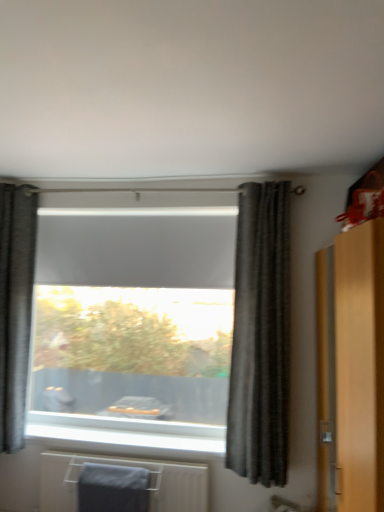
Based on the photo, measure the distance between gray fabric bath towel at lower left and camera.

gray fabric bath towel at lower left is 8.76 feet from camera.

Image resolution: width=384 pixels, height=512 pixels. What are the coordinates of `gray fabric bath towel at lower left` in the screenshot? It's located at (113, 488).

The height and width of the screenshot is (512, 384). Describe the element at coordinates (129, 466) in the screenshot. I see `gray matte towel at lower center` at that location.

The height and width of the screenshot is (512, 384). Describe the element at coordinates (260, 336) in the screenshot. I see `dark gray textured curtain at center, placed as the 2th curtain when sorted from left to right` at that location.

Where is `matte wooden dresser at right`? This screenshot has height=512, width=384. matte wooden dresser at right is located at coordinates (351, 368).

Locate an element on the screen. The image size is (384, 512). dark gray textured curtain at left, arranged as the second curtain when viewed from the right is located at coordinates pos(15,307).

Locate an element on the screen. The width and height of the screenshot is (384, 512). gray fabric bath towel at lower left is located at coordinates (113, 488).

Is gray matte blind at center a part of gray fabric bath towel at lower left?

That's incorrect, gray matte blind at center is not inside gray fabric bath towel at lower left.

Which object is further away from the camera, gray fabric bath towel at lower left or gray matte blind at center?

gray matte blind at center.

From their relative heights in the image, would you say gray fabric bath towel at lower left is taller or shorter than gray matte blind at center?

Clearly, gray fabric bath towel at lower left is shorter compared to gray matte blind at center.

Between gray fabric bath towel at lower left and gray matte blind at center, which one appears on the left side from the viewer's perspective?

gray fabric bath towel at lower left.

Is gray fabric bath towel at lower left facing away from dark gray textured curtain at left, arranged as the second curtain when viewed from the right?

No, gray fabric bath towel at lower left's orientation is not away from dark gray textured curtain at left, arranged as the second curtain when viewed from the right.

What are the coordinates of `bath towel below the dark gray textured curtain at left, the first curtain positioned from the left (from the image's perspective)` in the screenshot? It's located at (113, 488).

From the image's perspective, is gray fabric bath towel at lower left below dark gray textured curtain at left, the first curtain positioned from the left?

Yes.

Relative to dark gray textured curtain at left, the first curtain positioned from the left, is gray fabric bath towel at lower left in front or behind?

In the image, gray fabric bath towel at lower left appears in front of dark gray textured curtain at left, the first curtain positioned from the left.

Does gray matte towel at lower center have a lesser height compared to dark gray textured curtain at left, which is counted as the second curtain, starting from the front?

Correct, gray matte towel at lower center is not as tall as dark gray textured curtain at left, which is counted as the second curtain, starting from the front.

Considering the points (180, 501) and (0, 432), which point is in front, point (180, 501) or point (0, 432)?

Positioned in front is point (180, 501).

Is the surface of gray matte towel at lower center in direct contact with dark gray textured curtain at left, the first curtain positioned from the left?

There is a gap between gray matte towel at lower center and dark gray textured curtain at left, the first curtain positioned from the left.

Is gray matte towel at lower center oriented away from dark gray textured curtain at left, which is counted as the second curtain, starting from the front?

No, gray matte towel at lower center is not facing the opposite direction of dark gray textured curtain at left, which is counted as the second curtain, starting from the front.

Is matte wooden dresser at right behind gray fabric bath towel at lower left?

No, matte wooden dresser at right is in front of gray fabric bath towel at lower left.

Locate an element on the screen. The width and height of the screenshot is (384, 512). bath towel behind the matte wooden dresser at right is located at coordinates (113, 488).

From the image's perspective, which is above, matte wooden dresser at right or gray fabric bath towel at lower left?

matte wooden dresser at right, from the image's perspective.

From the picture: From a real-world perspective, is matte wooden dresser at right located beneath gray fabric bath towel at lower left?

No, from a real-world perspective, matte wooden dresser at right is not beneath gray fabric bath towel at lower left.

Is dark gray textured curtain at center, which appears as the first curtain when viewed from the right, inside the boundaries of gray matte blind at center, or outside?

dark gray textured curtain at center, which appears as the first curtain when viewed from the right, is not enclosed by gray matte blind at center.

Is point (265, 294) closer or farther from the camera than point (227, 266)?

Point (265, 294) is positioned closer to the camera compared to point (227, 266).

Considering the relative sizes of dark gray textured curtain at center, acting as the first curtain starting from the front, and gray matte blind at center in the image provided, is dark gray textured curtain at center, acting as the first curtain starting from the front, bigger than gray matte blind at center?

Correct, dark gray textured curtain at center, acting as the first curtain starting from the front, is larger in size than gray matte blind at center.

How distant is dark gray textured curtain at center, placed as the 2th curtain when sorted from left to right, from gray matte blind at center?

A distance of 29.07 inches exists between dark gray textured curtain at center, placed as the 2th curtain when sorted from left to right, and gray matte blind at center.

Which of these two, dark gray textured curtain at left, which is counted as the second curtain, starting from the front, or matte wooden dresser at right, stands shorter?

With less height is matte wooden dresser at right.

From the image's perspective, is dark gray textured curtain at left, marked as the 1th curtain in a back-to-front arrangement, above matte wooden dresser at right?

Indeed, from the image's perspective, dark gray textured curtain at left, marked as the 1th curtain in a back-to-front arrangement, is shown above matte wooden dresser at right.

Which is in front, dark gray textured curtain at left, arranged as the second curtain when viewed from the right, or matte wooden dresser at right?

matte wooden dresser at right.

Does point (11, 320) appear closer or farther from the camera than point (375, 393)?

Clearly, point (11, 320) is more distant from the camera than point (375, 393).

Between dark gray textured curtain at center, which is the second curtain from back to front, and gray fabric bath towel at lower left, which one has more height?

dark gray textured curtain at center, which is the second curtain from back to front, is taller.

Can you tell me how much dark gray textured curtain at center, which appears as the first curtain when viewed from the right, and gray fabric bath towel at lower left differ in facing direction?

There is a 2.43-degree angle between the facing directions of dark gray textured curtain at center, which appears as the first curtain when viewed from the right, and gray fabric bath towel at lower left.

Does dark gray textured curtain at center, which is the second curtain from back to front, turn towards gray fabric bath towel at lower left?

No, dark gray textured curtain at center, which is the second curtain from back to front, does not turn towards gray fabric bath towel at lower left.

Based on their positions, is dark gray textured curtain at center, which appears as the first curtain when viewed from the right, located to the left or right of gray fabric bath towel at lower left?

dark gray textured curtain at center, which appears as the first curtain when viewed from the right, is positioned on gray fabric bath towel at lower left's right side.

Find the location of a particular element. bath towel in front of the gray matte blind at center is located at coordinates (113, 488).

From the image's perspective, starting from the gray fabric bath towel at lower left, which curtain is the 2nd one above? Please provide its 2D coordinates.

[(15, 307)]

When comparing their distances from gray matte blind at center, does gray fabric bath towel at lower left or dark gray textured curtain at center, acting as the first curtain starting from the front, seem closer?

dark gray textured curtain at center, acting as the first curtain starting from the front, is closer to gray matte blind at center.

Based on their spatial positions, is gray fabric bath towel at lower left or dark gray textured curtain at left, arranged as the second curtain when viewed from the right, closer to gray matte blind at center?

dark gray textured curtain at left, arranged as the second curtain when viewed from the right, lies closer to gray matte blind at center than the other object.

Based on their spatial positions, is gray fabric bath towel at lower left or gray matte blind at center closer to matte wooden dresser at right?

Among the two, gray matte blind at center is located nearer to matte wooden dresser at right.

Estimate the real-world distances between objects in this image. Which object is closer to gray matte towel at lower center, matte wooden dresser at right or gray fabric bath towel at lower left?

gray fabric bath towel at lower left is closer to gray matte towel at lower center.

Considering their positions, is gray matte towel at lower center positioned closer to matte wooden dresser at right than dark gray textured curtain at center, which is the second curtain from back to front?

Among the two, dark gray textured curtain at center, which is the second curtain from back to front, is located nearer to matte wooden dresser at right.

Which object lies further to the anchor point dark gray textured curtain at center, placed as the 2th curtain when sorted from left to right, gray matte towel at lower center or matte wooden dresser at right?

matte wooden dresser at right is positioned further to the anchor dark gray textured curtain at center, placed as the 2th curtain when sorted from left to right.

Which object lies further to the anchor point gray matte towel at lower center, dark gray textured curtain at center, which is the second curtain from back to front, or gray matte blind at center?

gray matte blind at center lies further to gray matte towel at lower center than the other object.

Looking at the image, which one is located further to gray matte blind at center, dark gray textured curtain at left, arranged as the second curtain when viewed from the right, or gray matte towel at lower center?

gray matte towel at lower center lies further to gray matte blind at center than the other object.

Locate an element on the screen. Image resolution: width=384 pixels, height=512 pixels. radiator between matte wooden dresser at right and gray fabric bath towel at lower left from front to back is located at coordinates (129, 466).

You are a GUI agent. You are given a task and a screenshot of the screen. Output one action in this format:
    pyautogui.click(x=<x>, y=<y>)
    Task: Click on the blind between dark gray textured curtain at left, marked as the 1th curtain in a back-to-front arrangement, and dark gray textured curtain at center, acting as the first curtain starting from the front, from left to right
    
    Given the screenshot: What is the action you would take?
    pyautogui.click(x=137, y=247)

Image resolution: width=384 pixels, height=512 pixels. Find the location of `blind located between dark gray textured curtain at left, the first curtain positioned from the left, and matte wooden dresser at right in the left-right direction`. blind located between dark gray textured curtain at left, the first curtain positioned from the left, and matte wooden dresser at right in the left-right direction is located at coordinates (137, 247).

I want to click on radiator situated between dark gray textured curtain at left, arranged as the second curtain when viewed from the right, and matte wooden dresser at right from left to right, so click(129, 466).